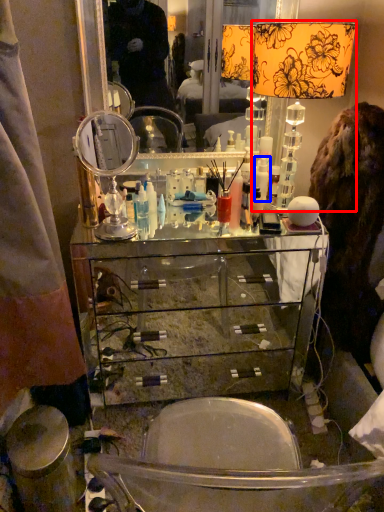
Question: Which of the following is the farthest to the observer, table lamp (highlighted by a red box) or toiletry (highlighted by a blue box)?

Choices:
 (A) table lamp
 (B) toiletry

Answer: (B)